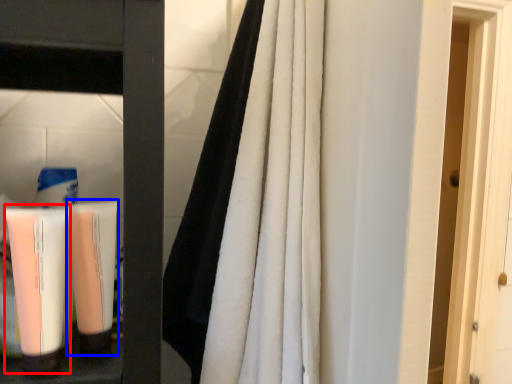
Question: Which object appears closest to the camera in this image, cleaning product (highlighted by a red box) or shaving cream (highlighted by a blue box)?

Choices:
 (A) cleaning product
 (B) shaving cream

Answer: (A)